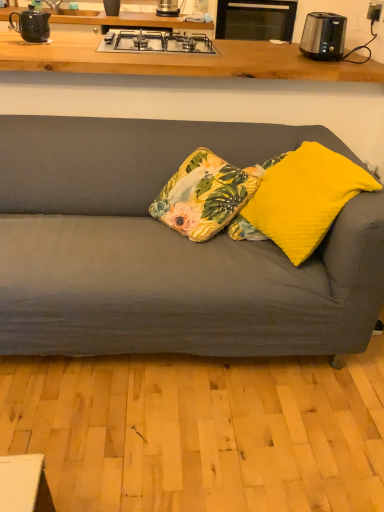
Question: Is floral fabric cushion at center, which ranks as the first pillow in left-to-right order, taller or shorter than silver metallic gas stove at upper center?

Choices:
 (A) tall
 (B) short

Answer: (A)

Question: Is floral fabric cushion at center, the third pillow positioned from the right, in front of or behind silver metallic gas stove at upper center in the image?

Choices:
 (A) front
 (B) behind

Answer: (A)

Question: Considering the real-world distances, which object is closest to the polished stainless steel toaster at upper right, which appears as the 1th kitchen appliance when viewed from the front?

Choices:
 (A) silver metallic gas stove at upper center
 (B) yellow soft cushion at right, the third pillow when ordered from left to right
 (C) yellow fabric pillow at center, the 2th pillow from the right
 (D) floral fabric cushion at center, which ranks as the first pillow in left-to-right order
 (E) matte black teapot at upper left

Answer: (A)

Question: Which is nearer to the yellow fabric pillow at center, which is the second pillow from left to right?

Choices:
 (A) polished stainless steel toaster at upper right, placed as the 2th kitchen appliance when sorted from top to bottom
 (B) yellow soft cushion at right, the third pillow when ordered from left to right
 (C) floral fabric cushion at center, the third pillow positioned from the right
 (D) silver metallic gas stove at upper center
 (E) satin silver toaster at upper center, the second kitchen appliance when ordered from bottom to top

Answer: (C)